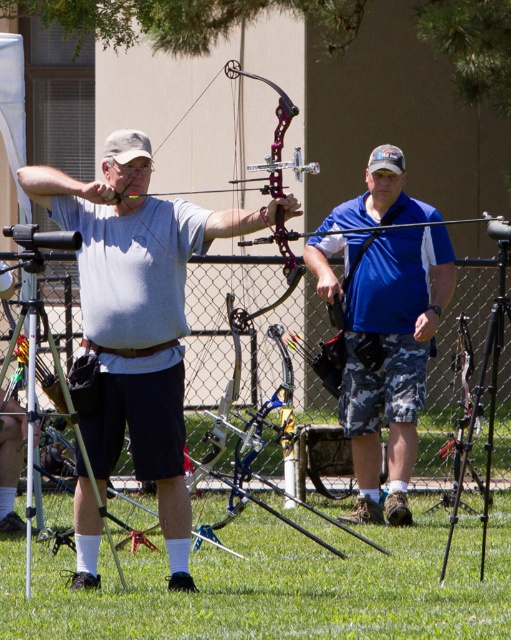
You are an archer standing at point (169, 417). You want to shoot an arrow to hit a target 30 feet away. Is the camera in your shooting path?

The distance between you and the camera is 26.73 feet, which is less than 30 feet. Therefore, the camera is within your shooting path.